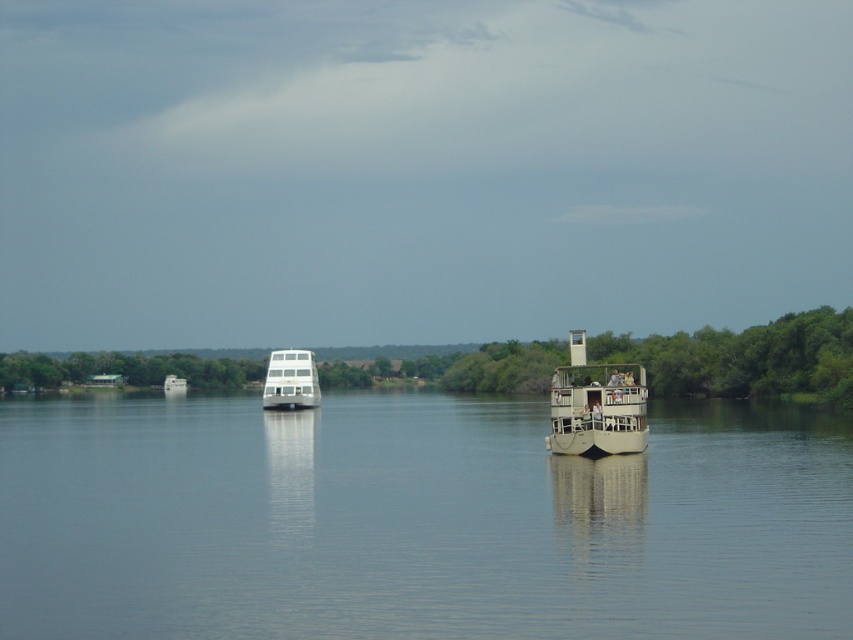
Is smooth water at center wider than beige wooden boat at center?

Yes, smooth water at center is wider than beige wooden boat at center.

Between smooth water at center and beige wooden boat at center, which one appears on the left side from the viewer's perspective?

Positioned to the left is smooth water at center.

Find the location of a particular element. The width and height of the screenshot is (853, 640). smooth water at center is located at coordinates (416, 520).

Measure the distance from smooth water at center to white glossy boat at center.

24.27 meters

The height and width of the screenshot is (640, 853). What are the coordinates of `smooth water at center` in the screenshot? It's located at (416, 520).

Does beige wooden boat at center appear over white glossy boat at center?

Indeed, beige wooden boat at center is positioned over white glossy boat at center.

Between point (605, 426) and point (270, 371), which one is positioned in front?

Positioned in front is point (605, 426).

Identify the location of beige wooden boat at center. (596, 404).